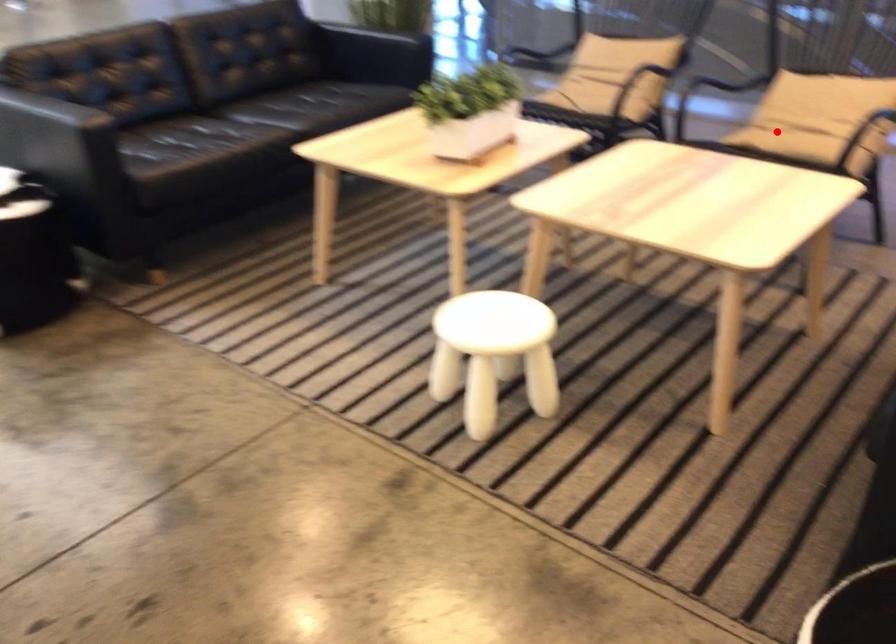
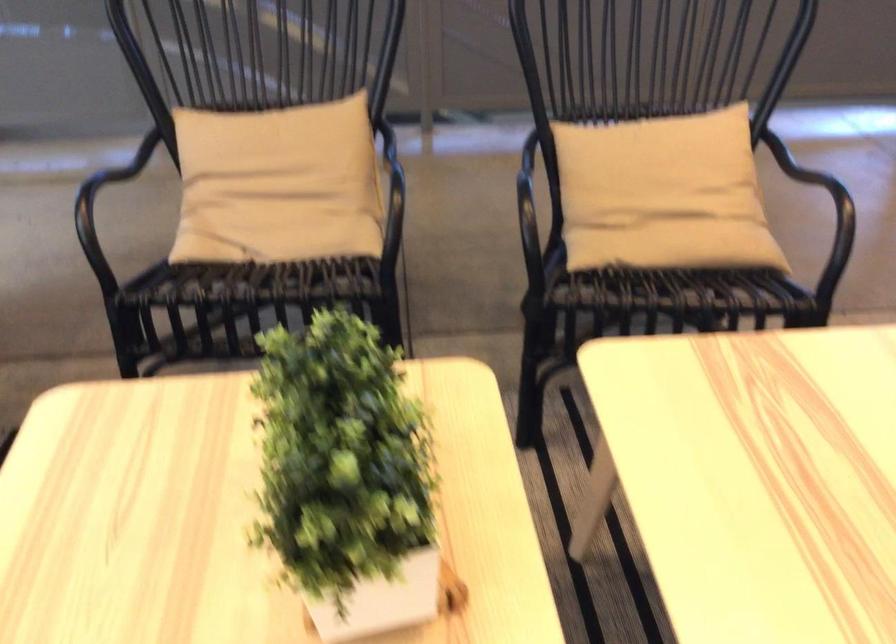
Question: I am providing you with two images of the same scene from different viewpoints. Given a red point in image1, look at the same physical point in image2. Is it:

Choices:
 (A) Closer to the viewpoint
 (B) Farther from the viewpoint

Answer: (A)